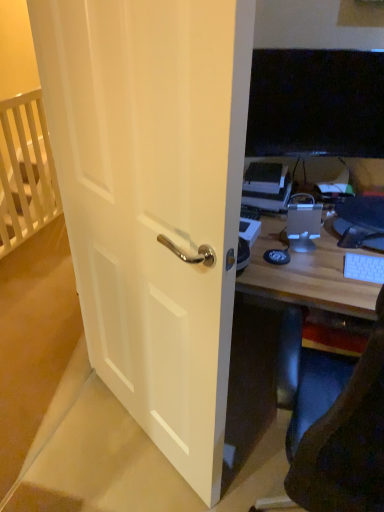
Find the location of `vacant area that is in front of white matte door at center`. vacant area that is in front of white matte door at center is located at coordinates (132, 474).